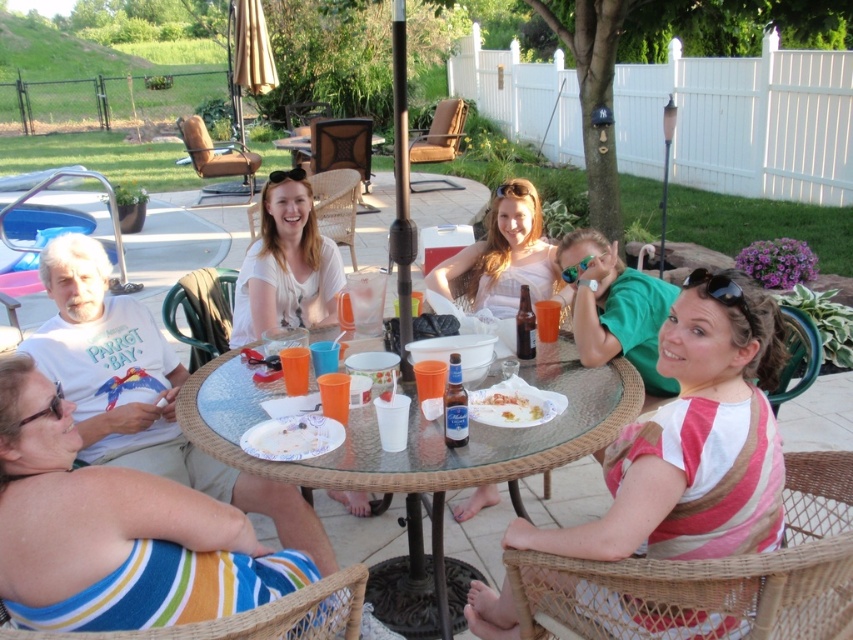
Question: Which object is the farthest from the matte white blouse at center?

Choices:
 (A) striped fabric shirt at lower left
 (B) striped fabric bikini top at lower left

Answer: (B)

Question: Which of the following is the closest to the observer?

Choices:
 (A) (689, 458)
 (B) (337, 484)

Answer: (A)

Question: Considering the relative positions of striped fabric shirt at lower left and transparent glass table at center in the image provided, where is striped fabric shirt at lower left located with respect to transparent glass table at center?

Choices:
 (A) left
 (B) right

Answer: (B)

Question: Is striped fabric shirt at lower left closer to camera compared to white paper plate at center?

Choices:
 (A) yes
 (B) no

Answer: (A)

Question: Is pink striped shirt at lower right bigger than white paper plate at center?

Choices:
 (A) no
 (B) yes

Answer: (B)

Question: Which point is closer to the camera taking this photo?

Choices:
 (A) (604, 260)
 (B) (660, 484)
 (C) (537, 401)
 (D) (585, 388)

Answer: (B)